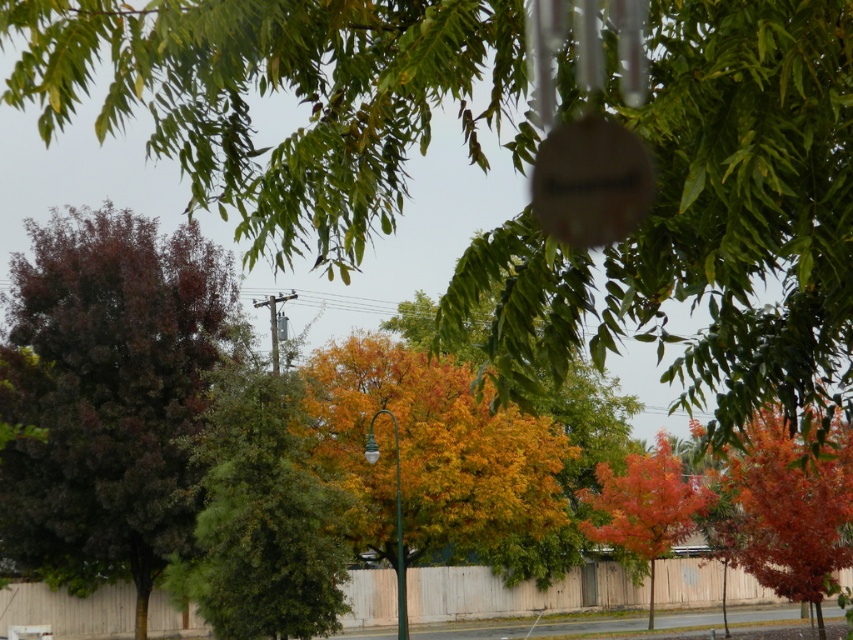
Question: Estimate the real-world distances between objects in this image. Which object is farther from the green leafy tree at upper center?

Choices:
 (A) dark purple foliage at left
 (B) orange leafy tree at right

Answer: (A)

Question: Which object appears closest to the camera in this image?

Choices:
 (A) dark purple foliage at left
 (B) orange leafy tree at right
 (C) orange glossy tree at center
 (D) green leafy tree at upper center

Answer: (D)

Question: Can you confirm if green leafy tree at upper center is smaller than orange leafy tree at right?

Choices:
 (A) yes
 (B) no

Answer: (B)

Question: Does green leafy tree at upper center appear on the left side of orange leafy tree at right?

Choices:
 (A) no
 (B) yes

Answer: (B)

Question: Is green leafy tree at upper center thinner than dark purple foliage at left?

Choices:
 (A) yes
 (B) no

Answer: (B)

Question: Which of the following is the closest to the observer?

Choices:
 (A) (71, 259)
 (B) (401, 184)

Answer: (B)